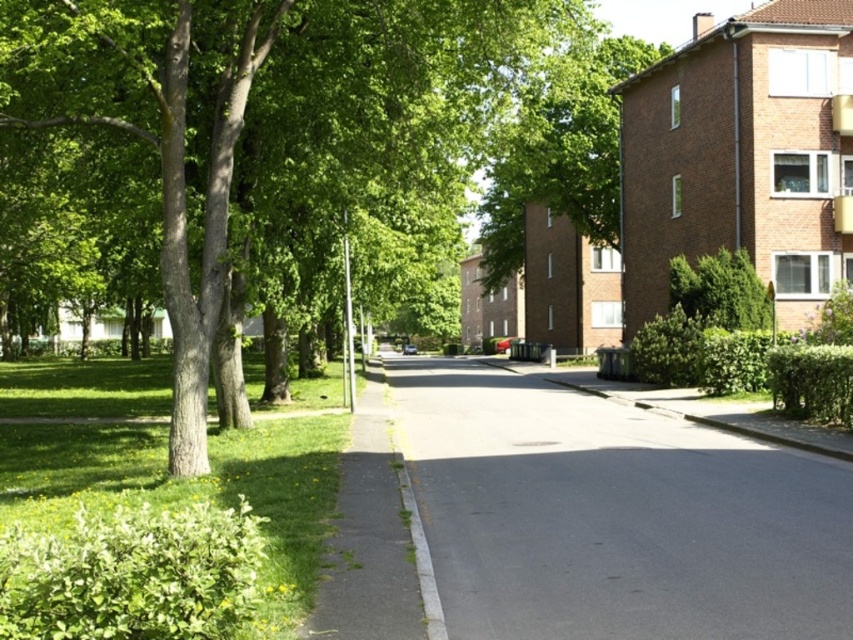
Is asphalt road at center positioned at the back of green leafy tree at upper center?

No, asphalt road at center is closer to the viewer.

Can you confirm if asphalt road at center is positioned above green leafy tree at upper center?

No, asphalt road at center is not above green leafy tree at upper center.

Identify the location of asphalt road at center. The image size is (853, 640). (614, 515).

This screenshot has width=853, height=640. What are the coordinates of `asphalt road at center` in the screenshot? It's located at (614, 515).

Is point (462, 188) positioned after point (541, 564)?

Yes.

Is green leafy tree at left wider than asphalt road at center?

Correct, the width of green leafy tree at left exceeds that of asphalt road at center.

Which is behind, point (201, 404) or point (488, 499)?

Positioned behind is point (201, 404).

At what (x,y) coordinates should I click in order to perform the action: click on green leafy tree at left. Please return your answer as a coordinate pair (x, y). The width and height of the screenshot is (853, 640). Looking at the image, I should click on (287, 140).

Does green leafy tree at left appear over green leafy tree at upper center?

Actually, green leafy tree at left is below green leafy tree at upper center.

Is point (305, 86) farther from viewer compared to point (502, 211)?

No, it is in front of (502, 211).

You are a GUI agent. You are given a task and a screenshot of the screen. Output one action in this format:
    pyautogui.click(x=<x>, y=<y>)
    Task: Click on the green leafy tree at left
    
    Given the screenshot: What is the action you would take?
    pyautogui.click(x=287, y=140)